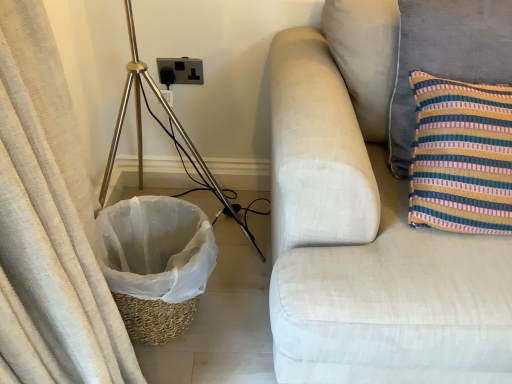
At what (x,y) coordinates should I click in order to perform the action: click on gold metallic tripod at left. Please return your answer as a coordinate pair (x, y). This screenshot has width=512, height=384. Looking at the image, I should click on [x=141, y=130].

The image size is (512, 384). I want to click on light beige fabric couch at right, so click(367, 228).

This screenshot has width=512, height=384. Identify the location of striped fabric pillow at right. (446, 57).

Is light beige fabric couch at right completely or partially inside braided straw laundry basket at lower left?

No, light beige fabric couch at right is not surrounded by braided straw laundry basket at lower left.

From the image's perspective, is braided straw laundry basket at lower left below light beige fabric couch at right?

Yes.

Based on the photo, does braided straw laundry basket at lower left turn towards light beige fabric couch at right?

No, braided straw laundry basket at lower left is not oriented towards light beige fabric couch at right.

Considering the relative sizes of braided straw laundry basket at lower left and light beige fabric couch at right in the image provided, is braided straw laundry basket at lower left wider than light beige fabric couch at right?

In fact, braided straw laundry basket at lower left might be narrower than light beige fabric couch at right.

Between striped fabric pillow at right and light beige fabric couch at right, which one has less height?

striped fabric pillow at right is shorter.

Can you confirm if striped fabric pillow at right is wider than light beige fabric couch at right?

Incorrect, the width of striped fabric pillow at right does not surpass that of light beige fabric couch at right.

The width and height of the screenshot is (512, 384). I want to click on pillow above the light beige fabric couch at right (from the image's perspective), so click(x=446, y=57).

Based on the photo, from a real-world perspective, is striped fabric pillow at right positioned under light beige fabric couch at right based on gravity?

No, from a real-world perspective, striped fabric pillow at right is not beneath light beige fabric couch at right.

Is striped fabric pillow at right outside of gold metallic tripod at left?

Yes.

Which is behind, point (492, 54) or point (245, 233)?

The point (245, 233) is behind.

Considering the sizes of objects striped fabric pillow at right and gold metallic tripod at left in the image provided, who is bigger, striped fabric pillow at right or gold metallic tripod at left?

gold metallic tripod at left is bigger.

Can you tell me how much gold metallic tripod at left and striped fabric pillow at right differ in facing direction?

The angular difference between gold metallic tripod at left and striped fabric pillow at right is 0.521 degrees.

Considering the points (163, 107) and (482, 20), which point is behind, point (163, 107) or point (482, 20)?

The point (163, 107) is more distant.

Where is `tripod on the left of the striped fabric pillow at right`? This screenshot has height=384, width=512. tripod on the left of the striped fabric pillow at right is located at coordinates [141, 130].

Is gold metallic tripod at left placed right next to striped fabric pillow at right?

No, gold metallic tripod at left is not with striped fabric pillow at right.

From the image's perspective, which one is positioned lower, light beige fabric couch at right or braided straw laundry basket at lower left?

braided straw laundry basket at lower left is shown below in the image.

Would you say light beige fabric couch at right is a long distance from braided straw laundry basket at lower left?

No, there isn't a large distance between light beige fabric couch at right and braided straw laundry basket at lower left.

From a real-world perspective, who is located lower, light beige fabric couch at right or braided straw laundry basket at lower left?

braided straw laundry basket at lower left, from a real-world perspective.

Is point (344, 297) less distant than point (140, 241)?

Yes, point (344, 297) is closer to viewer.

Is braided straw laundry basket at lower left at the right side of gold metallic tripod at left?

No, braided straw laundry basket at lower left is not to the right of gold metallic tripod at left.

From a real-world perspective, is braided straw laundry basket at lower left physically located above or below gold metallic tripod at left?

braided straw laundry basket at lower left is below gold metallic tripod at left.

In the scene shown: From the image's perspective, is braided straw laundry basket at lower left under gold metallic tripod at left?

Yes.

Is braided straw laundry basket at lower left facing towards gold metallic tripod at left?

No, braided straw laundry basket at lower left is not turned towards gold metallic tripod at left.

From the image's perspective, relative to braided straw laundry basket at lower left, is striped fabric pillow at right above or below?

striped fabric pillow at right is above braided straw laundry basket at lower left.

Could you tell me if striped fabric pillow at right is turned towards braided straw laundry basket at lower left?

No, striped fabric pillow at right is not aimed at braided straw laundry basket at lower left.

Is striped fabric pillow at right far from braided straw laundry basket at lower left?

No, striped fabric pillow at right is not far away from braided straw laundry basket at lower left.

What's the angular difference between striped fabric pillow at right and braided straw laundry basket at lower left's facing directions?

0.521 degrees separate the facing orientations of striped fabric pillow at right and braided straw laundry basket at lower left.

At what (x,y) coordinates should I click in order to perform the action: click on studio couch that is in front of the braided straw laundry basket at lower left. Please return your answer as a coordinate pair (x, y). This screenshot has height=384, width=512. Looking at the image, I should click on (367, 228).

Identify the location of pillow above the light beige fabric couch at right (from a real-world perspective). (446, 57).

Estimate the real-world distances between objects in this image. Which object is further from light beige fabric couch at right, striped fabric pillow at right or black plastic outlet at center?

black plastic outlet at center is positioned further to the anchor light beige fabric couch at right.

When comparing their distances from braided straw laundry basket at lower left, does black plastic outlet at center or striped fabric pillow at right seem closer?

Among the two, black plastic outlet at center is located nearer to braided straw laundry basket at lower left.

When comparing their distances from black plastic outlet at center, does braided straw laundry basket at lower left or gold metallic tripod at left seem closer?

gold metallic tripod at left is closer to black plastic outlet at center.

When comparing their distances from gold metallic tripod at left, does braided straw laundry basket at lower left or black plastic outlet at center seem closer?

Based on the image, black plastic outlet at center appears to be nearer to gold metallic tripod at left.

Based on their spatial positions, is striped fabric pillow at right or black plastic outlet at center further from braided straw laundry basket at lower left?

Among the two, striped fabric pillow at right is located further to braided straw laundry basket at lower left.

Looking at the image, which one is located closer to striped fabric pillow at right, gold metallic tripod at left or black plastic outlet at center?

Based on the image, gold metallic tripod at left appears to be nearer to striped fabric pillow at right.

Considering their positions, is striped fabric pillow at right positioned further to gold metallic tripod at left than black plastic outlet at center?

striped fabric pillow at right.

Considering their positions, is braided straw laundry basket at lower left positioned closer to gold metallic tripod at left than striped fabric pillow at right?

braided straw laundry basket at lower left is positioned closer to the anchor gold metallic tripod at left.

The height and width of the screenshot is (384, 512). I want to click on laundry basket between light beige fabric couch at right and black plastic outlet at center from front to back, so click(x=156, y=263).

Locate an element on the screen. The width and height of the screenshot is (512, 384). pillow positioned between light beige fabric couch at right and black plastic outlet at center from near to far is located at coordinates (446, 57).

Identify the location of tripod between black plastic outlet at center and striped fabric pillow at right. (141, 130).

Locate an element on the screen. The height and width of the screenshot is (384, 512). electric outlet situated between braided straw laundry basket at lower left and striped fabric pillow at right from left to right is located at coordinates (180, 71).